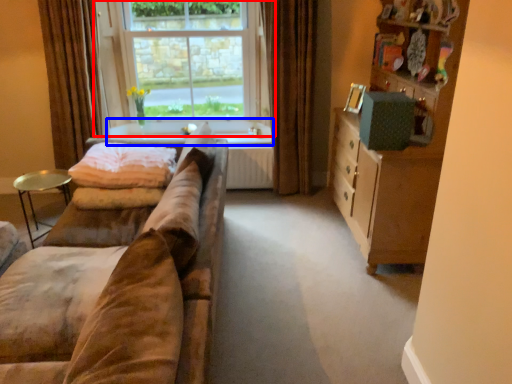
Question: Which of the following is the farthest to the observer, window (highlighted by a red box) or window sill (highlighted by a blue box)?

Choices:
 (A) window
 (B) window sill

Answer: (B)